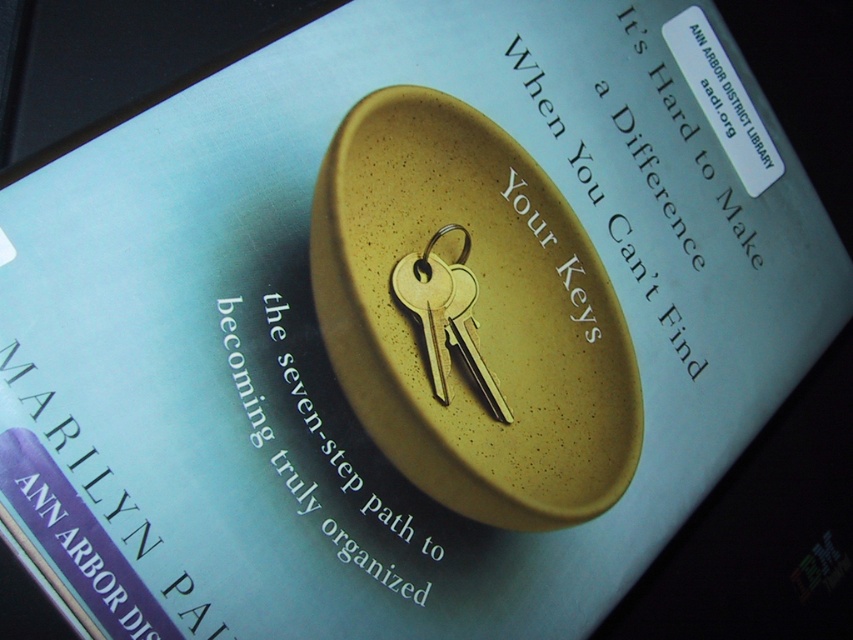
Question: Which point appears farthest from the camera in this image?

Choices:
 (A) click(x=527, y=378)
 (B) click(x=431, y=380)

Answer: (A)

Question: Considering the relative positions of goldspeckledkey ring and key at center and gold metallic key at center in the image provided, where is goldspeckledkey ring and key at center located with respect to gold metallic key at center?

Choices:
 (A) above
 (B) below

Answer: (A)

Question: Can you confirm if goldspeckledkey ring and key at center is positioned to the left of gold metallic key at center?

Choices:
 (A) yes
 (B) no

Answer: (B)

Question: Which point is farther to the camera?

Choices:
 (A) (404, 305)
 (B) (456, 202)

Answer: (B)

Question: Can you confirm if goldspeckledkey ring and key at center is thinner than gold metallic key at center?

Choices:
 (A) yes
 (B) no

Answer: (B)